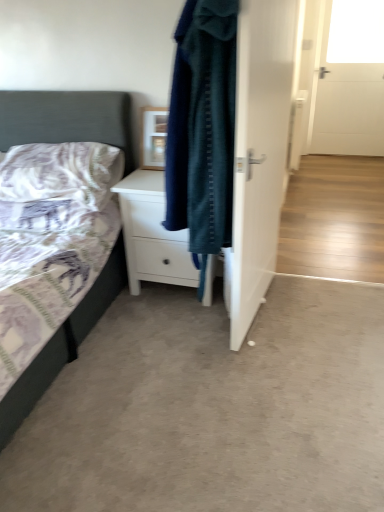
In order to click on matte wooden picture frame at center in this screenshot , I will do `click(153, 137)`.

What do you see at coordinates (67, 119) in the screenshot? The height and width of the screenshot is (512, 384). I see `textured fabric bed at left` at bounding box center [67, 119].

Measure the distance between point (46, 130) and camera.

A distance of 7.78 feet exists between point (46, 130) and camera.

Locate an element on the screen. white glossy door at center is located at coordinates (260, 149).

Is teal knitted sweater at center turned away from white glossy door at center?

Yes, teal knitted sweater at center is positioned with its back facing white glossy door at center.

Based on their sizes in the image, would you say teal knitted sweater at center is bigger or smaller than white glossy door at center?

In the image, teal knitted sweater at center appears to be smaller than white glossy door at center.

Consider the image. Considering the positions of objects teal knitted sweater at center and white glossy door at center in the image provided, who is more to the left, teal knitted sweater at center or white glossy door at center?

teal knitted sweater at center is more to the left.

Do you think teal knitted sweater at center is within white glossy door at center, or outside of it?

teal knitted sweater at center cannot be found inside white glossy door at center.

Would you say purple cotton pillow at left is to the left or to the right of teal knitted sweater at center in the picture?

purple cotton pillow at left is to the left of teal knitted sweater at center.

Considering the points (99, 210) and (224, 165), which point is behind, point (99, 210) or point (224, 165)?

The point (99, 210) is farther from the camera.

Can you tell me how much purple cotton pillow at left and teal knitted sweater at center differ in facing direction?

They differ by 95.6 degrees in their facing directions.

Is the position of purple cotton pillow at left less distant than that of teal knitted sweater at center?

That is False.

Is matte wooden picture frame at center smaller than textured fabric bed at left?

Yes, matte wooden picture frame at center is smaller than textured fabric bed at left.

Is matte wooden picture frame at center aimed at textured fabric bed at left?

No, matte wooden picture frame at center is not turned towards textured fabric bed at left.

I want to click on window screen on the right of purple cotton pillow at left, so click(x=356, y=32).

Considering the sizes of objects transparent glass window at upper right and purple cotton pillow at left in the image provided, who is taller, transparent glass window at upper right or purple cotton pillow at left?

transparent glass window at upper right is taller.

From a real-world perspective, is transparent glass window at upper right physically below purple cotton pillow at left?

Incorrect, from a real-world perspective, transparent glass window at upper right is higher than purple cotton pillow at left.

Is purple cotton pillow at left surrounded by transparent glass window at upper right?

No, purple cotton pillow at left is not a part of transparent glass window at upper right.

From the image's perspective, which object appears higher, matte wooden picture frame at center or purple cotton pillow at left?

matte wooden picture frame at center.

Considering their positions, is matte wooden picture frame at center located in front of or behind purple cotton pillow at left?

matte wooden picture frame at center is positioned farther from the viewer than purple cotton pillow at left.

Which point is more distant from viewer, (160, 114) or (92, 177)?

The point (160, 114) is farther from the camera.

Is transparent glass window at upper right wider or thinner than white matte chest of drawers at center?

transparent glass window at upper right is thinner than white matte chest of drawers at center.

Is transparent glass window at upper right positioned with its back to white matte chest of drawers at center?

No, white matte chest of drawers at center is not at the back of transparent glass window at upper right.

Does transparent glass window at upper right have a greater height compared to white matte chest of drawers at center?

Correct, transparent glass window at upper right is much taller as white matte chest of drawers at center.

Considering their positions, is transparent glass window at upper right located in front of or behind white matte chest of drawers at center?

Visually, transparent glass window at upper right is located behind white matte chest of drawers at center.

Is point (144, 119) farther from viewer compared to point (341, 2)?

No.

Consider the image. From the image's perspective, is matte wooden picture frame at center on transparent glass window at upper right?

No, from the image's perspective, matte wooden picture frame at center is not above transparent glass window at upper right.

Between matte wooden picture frame at center and transparent glass window at upper right, which one has smaller width?

With smaller width is transparent glass window at upper right.

Where is `picture frame in front of the transparent glass window at upper right`? The image size is (384, 512). picture frame in front of the transparent glass window at upper right is located at coordinates (153, 137).

The height and width of the screenshot is (512, 384). Identify the location of clothing on the left of white glossy door at center. (202, 128).

Locate an element on the screen. clothing on the right of purple cotton pillow at left is located at coordinates (202, 128).

Estimate the real-world distances between objects in this image. Which object is closer to white glossy door at center, textured fabric bed at left or white matte chest of drawers at center?

The object closer to white glossy door at center is white matte chest of drawers at center.

Which object lies nearer to the anchor point textured fabric bed at left, white matte chest of drawers at center or teal knitted sweater at center?

Based on the image, white matte chest of drawers at center appears to be nearer to textured fabric bed at left.

Estimate the real-world distances between objects in this image. Which object is further from transparent glass window at upper right, white matte chest of drawers at center or purple cotton pillow at left?

purple cotton pillow at left is further to transparent glass window at upper right.

Based on their spatial positions, is matte wooden picture frame at center or purple cotton pillow at left closer to transparent glass window at upper right?

matte wooden picture frame at center.

Estimate the real-world distances between objects in this image. Which object is closer to white glossy door at center, matte wooden picture frame at center or textured fabric bed at left?

matte wooden picture frame at center.

Estimate the real-world distances between objects in this image. Which object is closer to purple cotton pillow at left, textured fabric bed at left or transparent glass window at upper right?

Based on the image, textured fabric bed at left appears to be nearer to purple cotton pillow at left.

Based on the photo, estimate the real-world distances between objects in this image. Which object is further from matte wooden picture frame at center, white glossy door at center or textured fabric bed at left?

Among the two, white glossy door at center is located further to matte wooden picture frame at center.

Estimate the real-world distances between objects in this image. Which object is closer to teal knitted sweater at center, purple cotton pillow at left or matte wooden picture frame at center?

Based on the image, matte wooden picture frame at center appears to be nearer to teal knitted sweater at center.

Find the location of a particular element. Image resolution: width=384 pixels, height=512 pixels. door located between teal knitted sweater at center and white matte chest of drawers at center in the depth direction is located at coordinates (260, 149).

Locate an element on the screen. The image size is (384, 512). pillow between teal knitted sweater at center and transparent glass window at upper right along the z-axis is located at coordinates (61, 172).

The width and height of the screenshot is (384, 512). What are the coordinates of `pillow positioned between teal knitted sweater at center and matte wooden picture frame at center from near to far` in the screenshot? It's located at [61, 172].

This screenshot has width=384, height=512. Identify the location of chest of drawers between purple cotton pillow at left and teal knitted sweater at center in the horizontal direction. (152, 234).